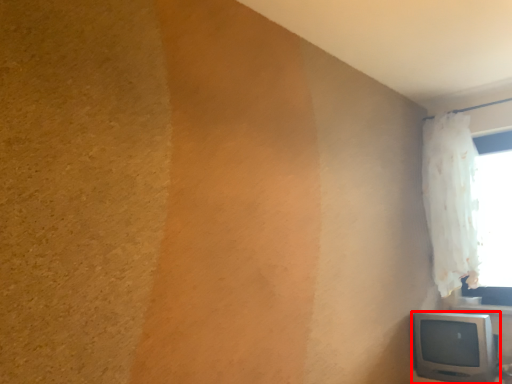
Question: From the image's perspective, what is the correct spatial relationship of television (annotated by the red box) in relation to window?

Choices:
 (A) above
 (B) below

Answer: (B)